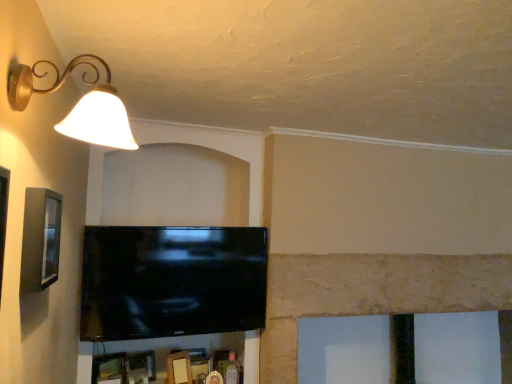
What do you see at coordinates (79, 105) in the screenshot?
I see `matte gold lampshade at upper left` at bounding box center [79, 105].

In order to face matte gray picture frame at left, should I rotate leftwards or rightwards?

A 26.185 degree turn to the left will do.

Identify the location of matte gold lampshade at upper left. (79, 105).

How much distance is there between matte gold lampshade at upper left and black glossy tv at center?

A distance of 1.18 meters exists between matte gold lampshade at upper left and black glossy tv at center.

Is matte gold lampshade at upper left positioned far away from black glossy tv at center?

Absolutely, matte gold lampshade at upper left is distant from black glossy tv at center.

Looking at this image, is matte gold lampshade at upper left at the left side of black glossy tv at center?

Yes, matte gold lampshade at upper left is to the left of black glossy tv at center.

From a real-world perspective, which object stands above the other?

matte gray picture frame at left, from a real-world perspective.

Is matte gray picture frame at left at the back of black glossy tv at center?

No, matte gray picture frame at left is not at the back of black glossy tv at center.

Is point (209, 314) more distant than point (54, 258)?

Yes, it is.

In the image, is black glossy tv at center positioned in front of or behind matte gold lampshade at upper left?

black glossy tv at center is behind matte gold lampshade at upper left.

Looking at this image, considering the sizes of objects black glossy tv at center and matte gold lampshade at upper left in the image provided, who is bigger, black glossy tv at center or matte gold lampshade at upper left?

With larger size is black glossy tv at center.

Which is in front, point (95, 256) or point (108, 115)?

Positioned in front is point (108, 115).

Locate an element on the screen. Image resolution: width=512 pixels, height=384 pixels. lamp above the black glossy tv at center (from the image's perspective) is located at coordinates (79, 105).

The width and height of the screenshot is (512, 384). I want to click on picture frame on the left of black glossy tv at center, so click(x=40, y=239).

Considering their positions, is matte gray picture frame at left located in front of or behind black glossy tv at center?

matte gray picture frame at left is in front of black glossy tv at center.

Would you say matte gray picture frame at left is inside or outside black glossy tv at center?

matte gray picture frame at left is spatially situated outside black glossy tv at center.

Considering the points (27, 279) and (234, 228), which point is behind, point (27, 279) or point (234, 228)?

The point (234, 228) is behind.

Consider the image. Between matte gold lampshade at upper left and matte gray picture frame at left, which one appears on the left side from the viewer's perspective?

Positioned to the left is matte gray picture frame at left.

From a real-world perspective, relative to matte gray picture frame at left, is matte gold lampshade at upper left vertically above or below?

From a real-world perspective, matte gold lampshade at upper left is physically above matte gray picture frame at left.

Considering the sizes of matte gold lampshade at upper left and matte gray picture frame at left in the image, is matte gold lampshade at upper left taller or shorter than matte gray picture frame at left?

matte gold lampshade at upper left is shorter than matte gray picture frame at left.

Is matte gray picture frame at left completely or partially inside matte gold lampshade at upper left?

That's incorrect, matte gray picture frame at left is not inside matte gold lampshade at upper left.

Does matte gray picture frame at left appear on the left side of matte gold lampshade at upper left?

Correct, you'll find matte gray picture frame at left to the left of matte gold lampshade at upper left.

Do you think matte gray picture frame at left is within matte gold lampshade at upper left, or outside of it?

matte gray picture frame at left is not enclosed by matte gold lampshade at upper left.

Based on the photo, is matte gray picture frame at left further to the viewer compared to matte gold lampshade at upper left?

Yes, matte gray picture frame at left is further from the camera.

This screenshot has width=512, height=384. In order to click on picture frame that is below the matte gold lampshade at upper left (from the image's perspective) in this screenshot , I will do `click(40, 239)`.

This screenshot has height=384, width=512. I want to click on television on the right of matte gold lampshade at upper left, so (x=172, y=281).

Where is `picture frame above the black glossy tv at center (from a real-world perspective)`? The image size is (512, 384). picture frame above the black glossy tv at center (from a real-world perspective) is located at coordinates (40, 239).

From the image, which object appears to be nearer to matte gold lampshade at upper left, matte gray picture frame at left or black glossy tv at center?

Based on the image, matte gray picture frame at left appears to be nearer to matte gold lampshade at upper left.

Looking at the image, which one is located further to matte gold lampshade at upper left, black glossy tv at center or matte gray picture frame at left?

black glossy tv at center is further to matte gold lampshade at upper left.

Based on their spatial positions, is black glossy tv at center or matte gold lampshade at upper left closer to matte gray picture frame at left?

matte gold lampshade at upper left lies closer to matte gray picture frame at left than the other object.

When comparing their distances from black glossy tv at center, does matte gray picture frame at left or matte gold lampshade at upper left seem closer?

Among the two, matte gray picture frame at left is located nearer to black glossy tv at center.

When comparing their distances from black glossy tv at center, does matte gold lampshade at upper left or matte gray picture frame at left seem further?

matte gold lampshade at upper left is positioned further to the anchor black glossy tv at center.

Which object lies further to the anchor point matte gray picture frame at left, matte gold lampshade at upper left or black glossy tv at center?

black glossy tv at center is positioned further to the anchor matte gray picture frame at left.

The height and width of the screenshot is (384, 512). Identify the location of picture frame located between matte gold lampshade at upper left and black glossy tv at center in the depth direction. (40, 239).